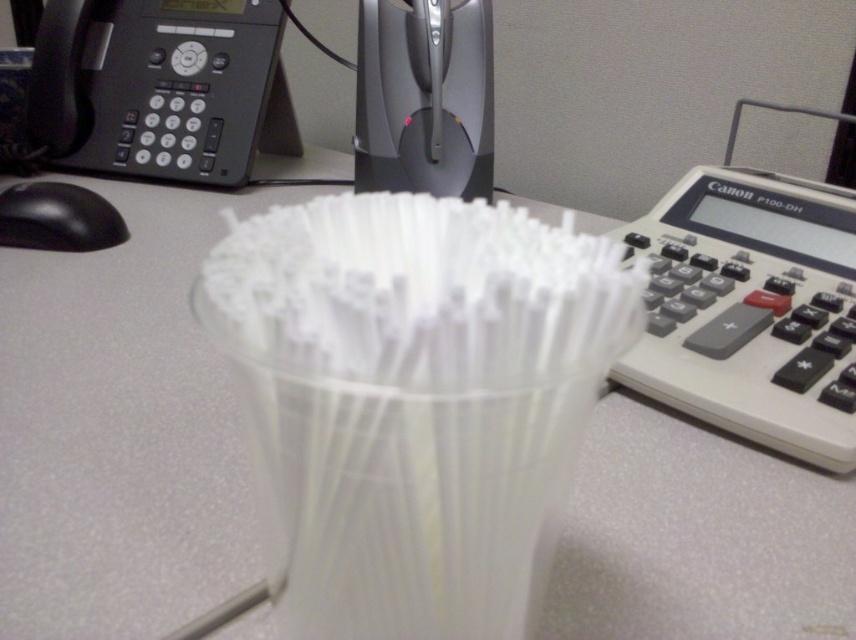
Which is below, white plastic calculator at right or black plastic phone at upper left?

Positioned lower is white plastic calculator at right.

Is white plastic calculator at right bigger than black plastic phone at upper left?

No.

Between point (759, 312) and point (159, 148), which one is positioned in front?

Point (759, 312) is more forward.

Where is `white plastic calculator at right`? The width and height of the screenshot is (856, 640). white plastic calculator at right is located at coordinates (752, 308).

Can you confirm if transparent plastic straws at center is wider than black plastic phone at upper left?

Incorrect, transparent plastic straws at center's width does not surpass black plastic phone at upper left's.

This screenshot has width=856, height=640. Identify the location of transparent plastic straws at center. (414, 401).

This screenshot has height=640, width=856. In order to click on transparent plastic straws at center in this screenshot , I will do `click(414, 401)`.

Does transparent plastic straws at center come in front of white plastic calculator at right?

Yes, transparent plastic straws at center is closer to the viewer.

Who is more forward, (432, 269) or (657, 246)?

→ Point (432, 269)

Which is in front, point (536, 282) or point (798, 276)?

Positioned in front is point (536, 282).

Identify the location of transparent plastic straws at center. The width and height of the screenshot is (856, 640). (414, 401).